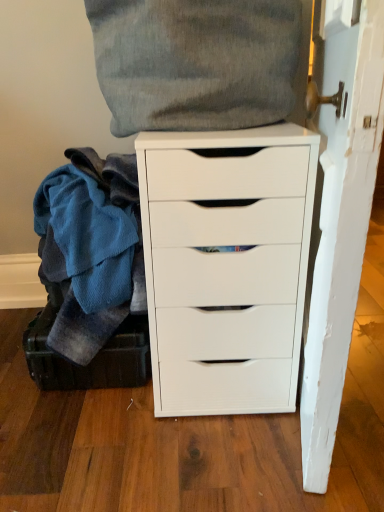
Question: Considering the positions of point (86, 378) and point (112, 185), is point (86, 378) closer or farther from the camera than point (112, 185)?

Choices:
 (A) farther
 (B) closer

Answer: (A)

Question: From the image's perspective, is dark green leather suitcase at lower left above or below blue fleece blanket at left, the first clothing from the bottom?

Choices:
 (A) above
 (B) below

Answer: (B)

Question: Which is nearer to the blue fleece blanket at left, the second clothing in the top-to-bottom sequence?

Choices:
 (A) soft gray fabric pillow at upper center, the first clothing when ordered from top to bottom
 (B) dark green leather suitcase at lower left
 (C) white matte chest of drawers at center

Answer: (B)

Question: Which object is positioned farthest from the soft gray fabric pillow at upper center, the first clothing when ordered from top to bottom?

Choices:
 (A) blue fleece blanket at left, the first clothing from the bottom
 (B) dark green leather suitcase at lower left
 (C) white matte chest of drawers at center

Answer: (B)